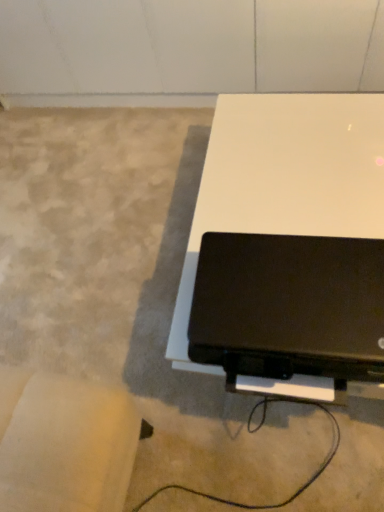
The image size is (384, 512). What are the coordinates of `free spot above black matte laptop at lower right (from a real-world perspective)` in the screenshot? It's located at (296, 298).